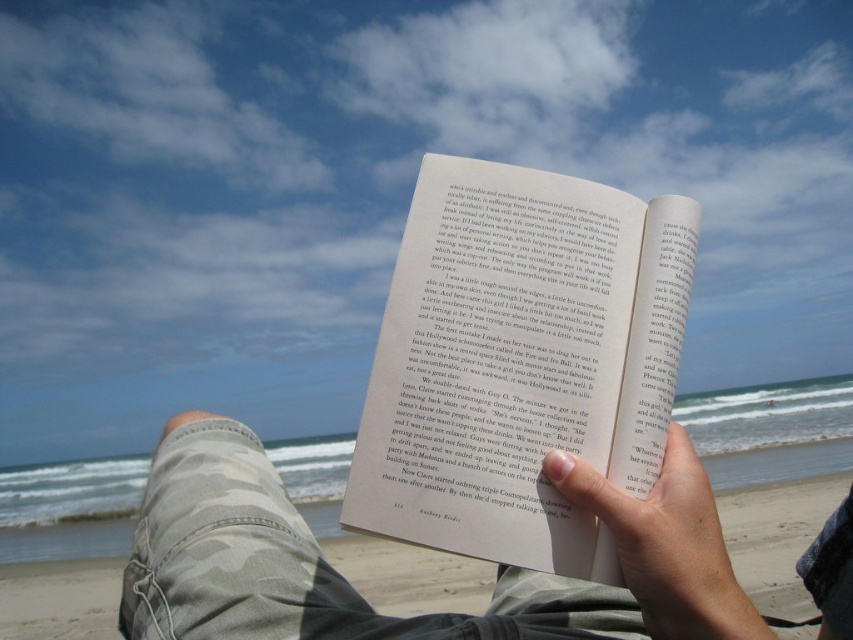
Can you confirm if camouflage pants at lower left is bigger than smooth skin hand at center?

Yes, camouflage pants at lower left is bigger than smooth skin hand at center.

Who is more distant from viewer, (618, 605) or (663, 625)?

The point (618, 605) is more distant.

Identify the location of camouflage pants at lower left. The image size is (853, 640). (x=415, y=616).

Locate an element on the screen. The image size is (853, 640). camouflage pants at lower left is located at coordinates (415, 616).

Which is in front, point (537, 241) or point (566, 483)?

Point (566, 483) is in front.

Can you confirm if matte paper book at center is positioned to the right of smooth skin hand at center?

No, matte paper book at center is not to the right of smooth skin hand at center.

Is point (538, 332) positioned after point (680, 560)?

Yes.

Where is `matte paper book at center`? The width and height of the screenshot is (853, 640). matte paper book at center is located at coordinates (520, 362).

Is matte paper book at center wider than camouflage pants at lower left?

Incorrect, matte paper book at center's width does not surpass camouflage pants at lower left's.

Does matte paper book at center appear under camouflage pants at lower left?

Actually, matte paper book at center is above camouflage pants at lower left.

Image resolution: width=853 pixels, height=640 pixels. Identify the location of matte paper book at center. (520, 362).